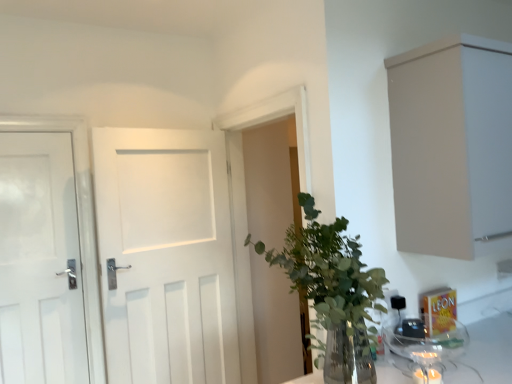
Question: From a real-world perspective, is green leafy plant at center positioned over white matte door at left, which ranks as the 2th door in right-to-left order, based on gravity?

Choices:
 (A) yes
 (B) no

Answer: (B)

Question: Is green leafy plant at center positioned in front of white matte door at left, which ranks as the 2th door in right-to-left order?

Choices:
 (A) yes
 (B) no

Answer: (A)

Question: From the image's perspective, is green leafy plant at center over white matte door at left, which ranks as the 2th door in right-to-left order?

Choices:
 (A) no
 (B) yes

Answer: (B)

Question: From a real-world perspective, does green leafy plant at center sit lower than white matte door at left, which ranks as the 2th door in right-to-left order?

Choices:
 (A) yes
 (B) no

Answer: (A)

Question: Is green leafy plant at center positioned with its back to white matte door at left, positioned as the first door in left-to-right order?

Choices:
 (A) no
 (B) yes

Answer: (A)

Question: Considering the relative sizes of green leafy plant at center and white matte door at left, which ranks as the 2th door in right-to-left order, in the image provided, is green leafy plant at center smaller than white matte door at left, which ranks as the 2th door in right-to-left order,?

Choices:
 (A) yes
 (B) no

Answer: (B)

Question: Is green leafy plant at center looking in the opposite direction of transparent glass jar at lower right?

Choices:
 (A) yes
 (B) no

Answer: (B)

Question: Is green leafy plant at center in contact with transparent glass jar at lower right?

Choices:
 (A) no
 (B) yes

Answer: (A)

Question: From a real-world perspective, is green leafy plant at center on top of transparent glass jar at lower right?

Choices:
 (A) yes
 (B) no

Answer: (A)

Question: From a real-world perspective, is green leafy plant at center located beneath transparent glass jar at lower right?

Choices:
 (A) no
 (B) yes

Answer: (A)

Question: Does green leafy plant at center come in front of transparent glass jar at lower right?

Choices:
 (A) no
 (B) yes

Answer: (B)

Question: Considering the relative sizes of green leafy plant at center and transparent glass jar at lower right in the image provided, is green leafy plant at center bigger than transparent glass jar at lower right?

Choices:
 (A) yes
 (B) no

Answer: (A)

Question: From a real-world perspective, is transparent glass jar at lower right physically above green leafy plant at center?

Choices:
 (A) yes
 (B) no

Answer: (B)